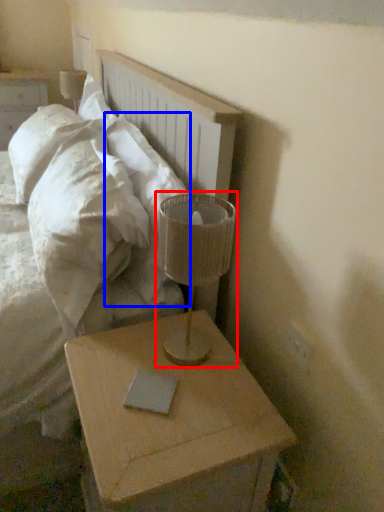
Question: Which of the following is the farthest to the observer, table lamp (highlighted by a red box) or pillow (highlighted by a blue box)?

Choices:
 (A) table lamp
 (B) pillow

Answer: (B)